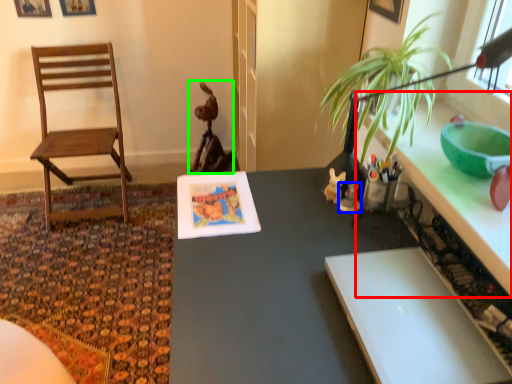
Question: Based on their relative distances, which object is farther from counter top (highlighted by a red box)? Choose from toy (highlighted by a blue box) and animal (highlighted by a green box).

Choices:
 (A) toy
 (B) animal

Answer: (B)